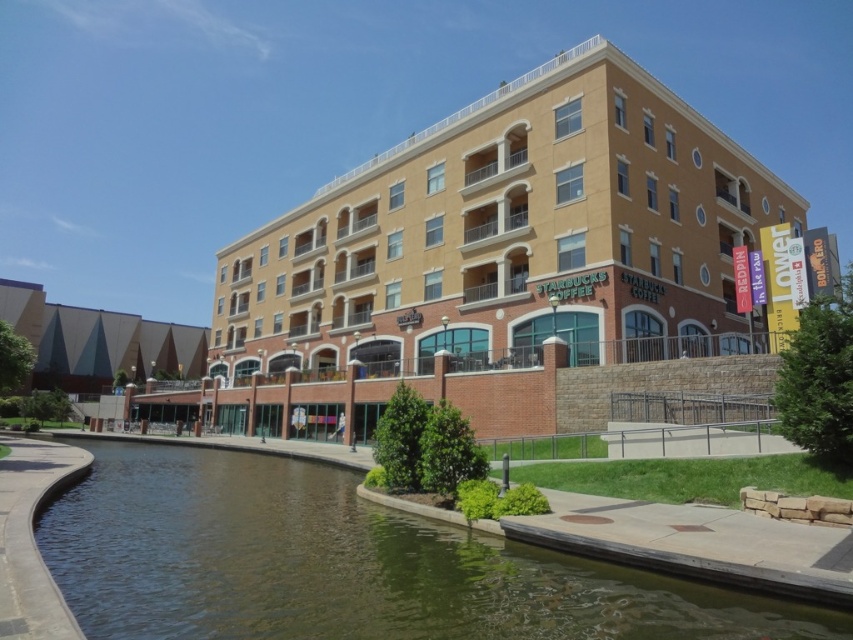
Which of these two, beige brick building at center or brown concrete river at lower left, stands shorter?

Standing shorter between the two is brown concrete river at lower left.

Measure the distance between point (515, 81) and camera.

The distance of point (515, 81) from camera is 297.97 meters.

You are a GUI agent. You are given a task and a screenshot of the screen. Output one action in this format:
    pyautogui.click(x=<x>, y=<y>)
    Task: Click on the beige brick building at center
    The width and height of the screenshot is (853, 640).
    Given the screenshot: What is the action you would take?
    pyautogui.click(x=508, y=237)